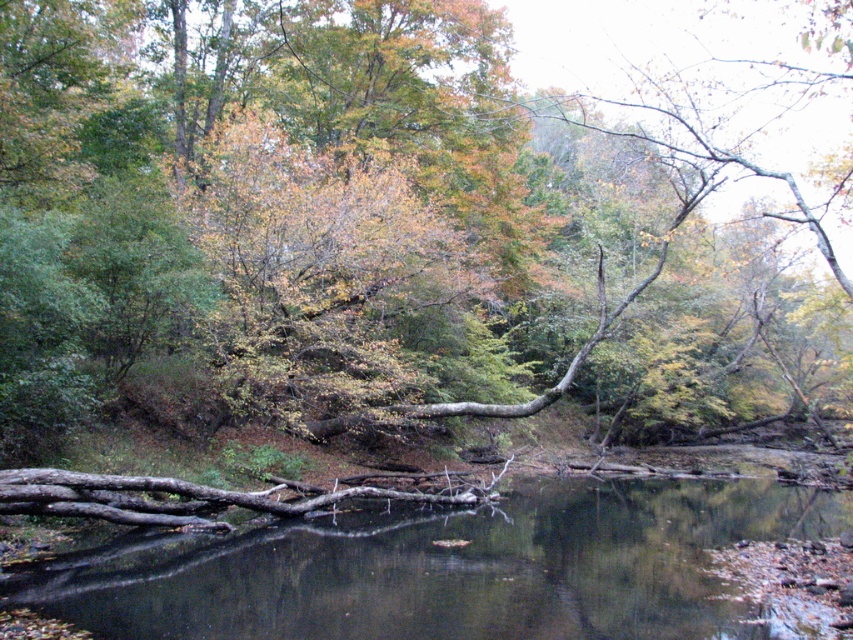
Question: Which point is farther to the camera?

Choices:
 (A) brown rough tree trunk at center
 (B) brown wood at center

Answer: (A)

Question: Is brown rough tree trunk at center thinner than brown wood at center?

Choices:
 (A) yes
 (B) no

Answer: (B)

Question: Which point is farther to the camera?

Choices:
 (A) brown wood at center
 (B) brown rough tree trunk at center

Answer: (B)

Question: Is brown rough tree trunk at center positioned behind brown wood at center?

Choices:
 (A) no
 (B) yes

Answer: (B)

Question: Among these points, which one is farthest from the camera?

Choices:
 (A) (486, 192)
 (B) (666, 620)

Answer: (A)

Question: Does brown rough tree trunk at center have a smaller size compared to brown wood at center?

Choices:
 (A) yes
 (B) no

Answer: (B)